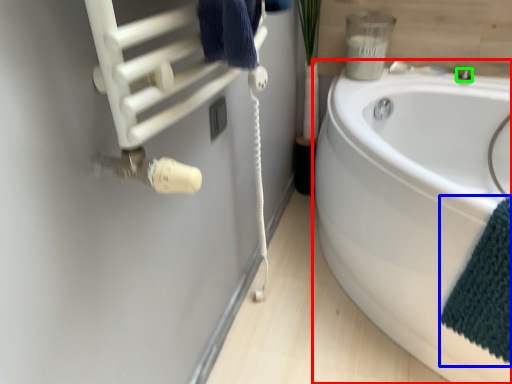
Question: Which is farther away from bathtub (highlighted by a red box)? bath towel (highlighted by a blue box) or faucet (highlighted by a green box)?

Choices:
 (A) bath towel
 (B) faucet

Answer: (B)